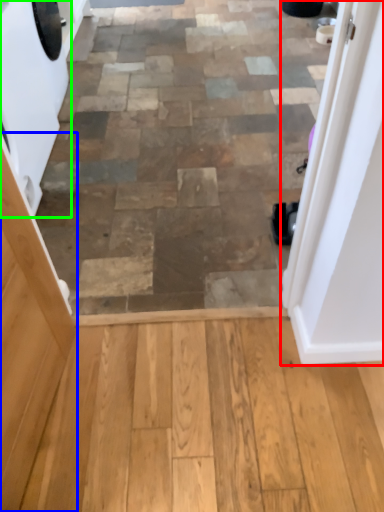
Question: Which object is positioned closest to door (highlighted by a red box)? Select from screen door (highlighted by a blue box) and washing machine (highlighted by a green box).

Choices:
 (A) screen door
 (B) washing machine

Answer: (A)